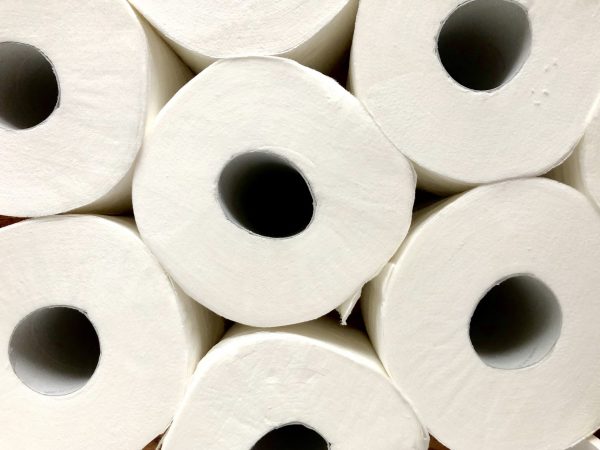
You are a GUI agent. You are given a task and a screenshot of the screen. Output one action in this format:
    pyautogui.click(x=<x>, y=<y>)
    Task: Click on the toilet paper roll
    
    Given the screenshot: What is the action you would take?
    pyautogui.click(x=135, y=331), pyautogui.click(x=226, y=373), pyautogui.click(x=408, y=314), pyautogui.click(x=360, y=225), pyautogui.click(x=420, y=110), pyautogui.click(x=274, y=24), pyautogui.click(x=106, y=76)